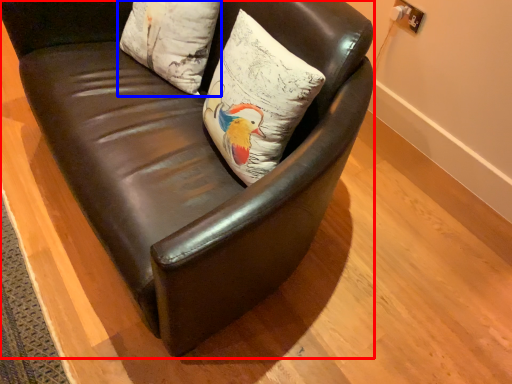
Question: Which point is closer to the camera, chair (highlighted by a red box) or pillow (highlighted by a blue box)?

Choices:
 (A) chair
 (B) pillow

Answer: (A)